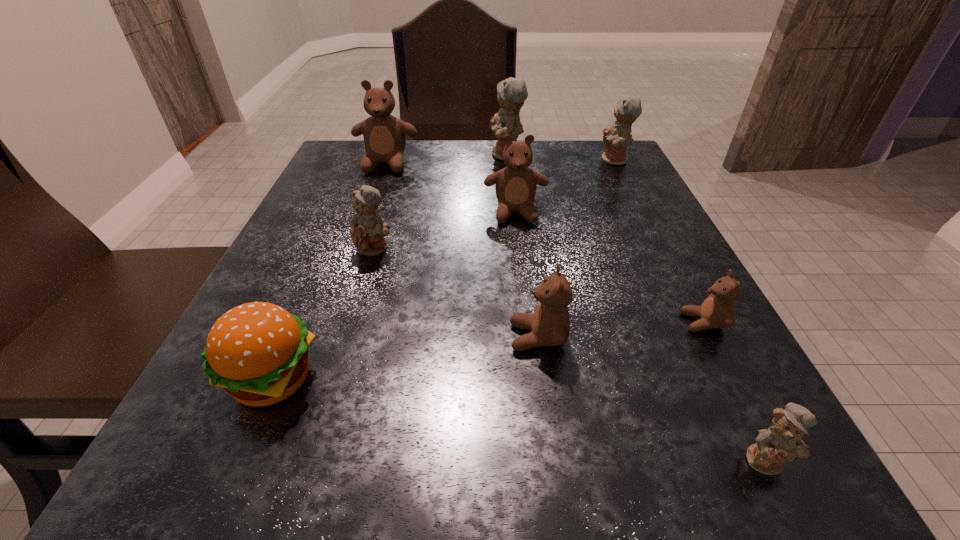
What are the coordinates of `the nearest object` in the screenshot? It's located at (782, 440).

You are a GUI agent. You are given a task and a screenshot of the screen. Output one action in this format:
    pyautogui.click(x=<x>, y=<y>)
    Task: Click on the smallest blue teddy bear
    The height and width of the screenshot is (540, 960).
    Given the screenshot: What is the action you would take?
    pyautogui.click(x=782, y=440)

The image size is (960, 540). What are the coordinates of `the smallest brown teddy bear` in the screenshot? It's located at (717, 311).

What are the coordinates of `vacant space located on the front-facing side of the third blue teddy bear from right to left` in the screenshot? It's located at pyautogui.click(x=406, y=155).

Find the location of a particular element. free space located on the front-facing side of the third blue teddy bear from right to left is located at coordinates (431, 155).

Image resolution: width=960 pixels, height=540 pixels. I want to click on vacant region located 0.340m on the front-facing side of the third blue teddy bear from right to left, so click(348, 155).

Identify the location of free point located on the front-facing side of the leftmost brown teddy bear. This screenshot has height=540, width=960. (372, 202).

Where is `vacant space located on the front-facing side of the second biggest blue teddy bear`? Image resolution: width=960 pixels, height=540 pixels. vacant space located on the front-facing side of the second biggest blue teddy bear is located at coordinates (468, 160).

Identify the location of vacant space located on the front-facing side of the second biggest blue teddy bear. (472, 160).

Find the location of a particular element. vacant space located 0.400m on the front-facing side of the second biggest blue teddy bear is located at coordinates (430, 160).